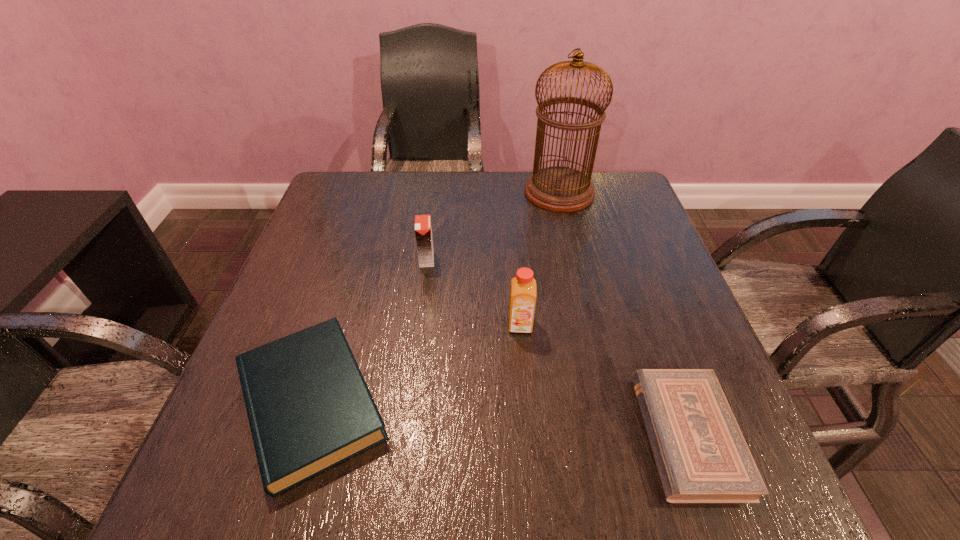
Where is `Bible positioned at the near edge`? Bible positioned at the near edge is located at coordinates (701, 455).

This screenshot has height=540, width=960. In order to click on object that is positioned at the left edge in this screenshot , I will do click(x=309, y=408).

You are a GUI agent. You are given a task and a screenshot of the screen. Output one action in this format:
    pyautogui.click(x=<x>, y=<y>)
    Task: Click on the birdcage positioned at the right edge
    
    Given the screenshot: What is the action you would take?
    pyautogui.click(x=562, y=189)

This screenshot has height=540, width=960. I want to click on Bible that is at the right edge, so click(x=701, y=455).

You are a GUI agent. You are given a task and a screenshot of the screen. Output one action in this format:
    pyautogui.click(x=<x>, y=<y>)
    Task: Click on the object at the near left corner
    The width and height of the screenshot is (960, 540).
    Given the screenshot: What is the action you would take?
    pyautogui.click(x=309, y=408)

I want to click on object present at the far right corner, so click(x=562, y=189).

Where is `object located at the near right corner`? Image resolution: width=960 pixels, height=540 pixels. object located at the near right corner is located at coordinates (701, 455).

The height and width of the screenshot is (540, 960). I want to click on vacant space at the far edge of the desktop, so click(407, 190).

The width and height of the screenshot is (960, 540). Identify the location of free space at the near edge of the desktop. (623, 487).

Where is `blank space at the left edge of the desktop`? Image resolution: width=960 pixels, height=540 pixels. blank space at the left edge of the desktop is located at coordinates (322, 276).